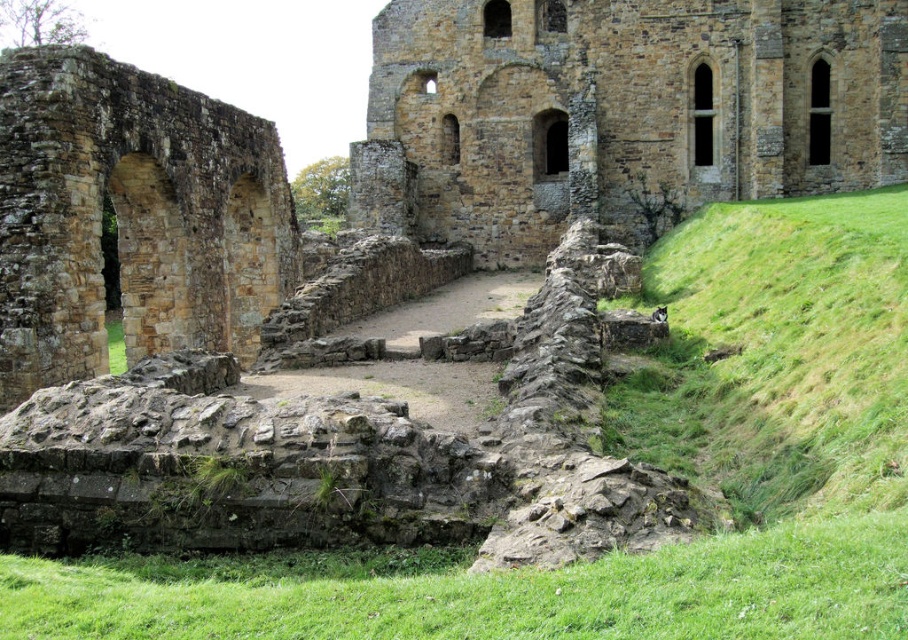
You are an archaeologist exploring the ancient ruins. You notice the brown stone wall at center and the brown stone arch at left. Which structure is located higher up in the image?

The brown stone wall at center is positioned over the brown stone arch at left, meaning it is higher up in the image.

You are an archaeologist exploring the ancient ruins. You see the brown stone wall at center and the brown stone arch at left. Which object is positioned to the right of the other?

The brown stone wall at center is positioned to the right of the brown stone arch at left.

From the picture: You are standing at the entrance of the ancient stone structure and want to reach the brown stone wall at center. Which direction should you walk to get there?

Walk towards the center of the image to reach the brown stone wall at center located at point (619, 113).